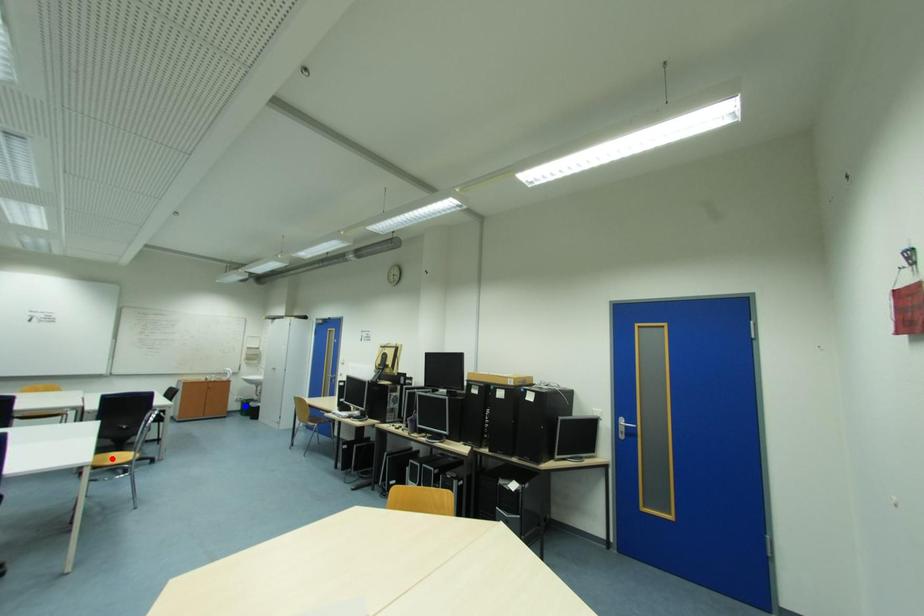
Question: Which of the two points in the image is closer to the camera?

Choices:
 (A) Blue point is closer.
 (B) Red point is closer.

Answer: (B)